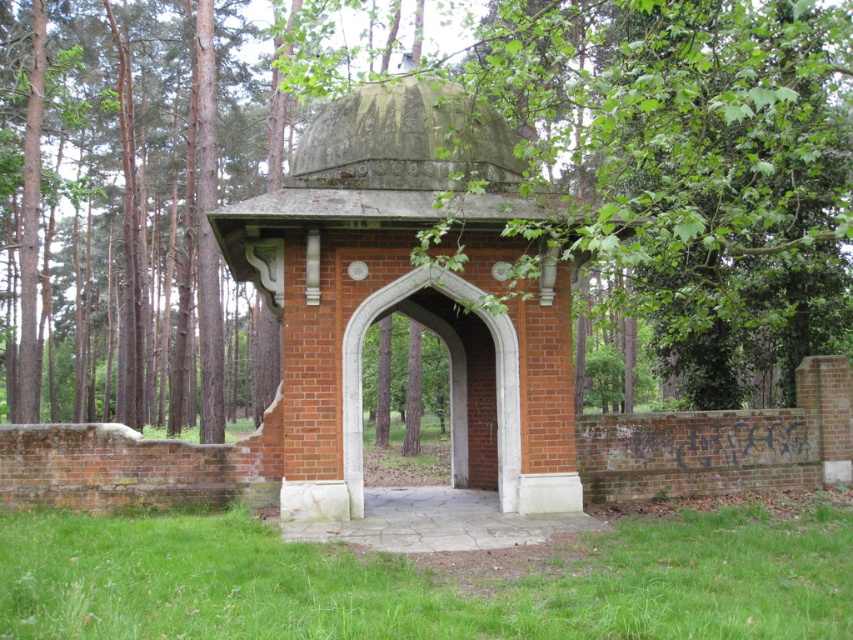
This screenshot has height=640, width=853. In order to click on green leafy tree at center in this screenshot , I will do `click(614, 168)`.

Who is higher up, green leafy tree at center or red brick gazebo at center?

Positioned higher is green leafy tree at center.

Is point (717, 336) positioned after point (502, 387)?

Yes, it is behind point (502, 387).

Locate an element on the screen. The image size is (853, 640). green leafy tree at center is located at coordinates (614, 168).

What do you see at coordinates (409, 296) in the screenshot? I see `red brick gazebo at center` at bounding box center [409, 296].

Identify the location of red brick gazebo at center. (409, 296).

Where is `green leafy tree at center`? The height and width of the screenshot is (640, 853). green leafy tree at center is located at coordinates (614, 168).

The image size is (853, 640). Identify the location of green leafy tree at center. (614, 168).

You are a GUI agent. You are given a task and a screenshot of the screen. Output one action in this format:
    pyautogui.click(x=<x>, y=<y>)
    Task: Click on the green leafy tree at center
    This screenshot has width=853, height=640.
    Given the screenshot: What is the action you would take?
    pyautogui.click(x=614, y=168)